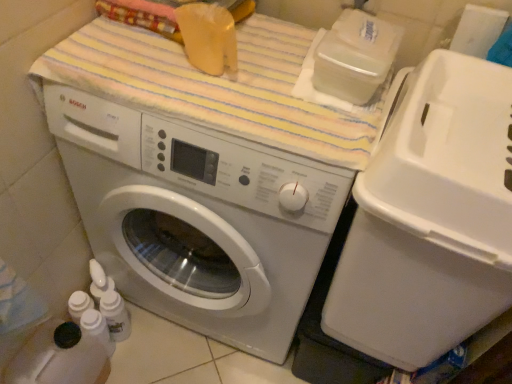
Question: From a real-world perspective, is striped cotton bath towel at upper center under white plastic water cooler at right?

Choices:
 (A) yes
 (B) no

Answer: (B)

Question: Does striped cotton bath towel at upper center turn towards white plastic water cooler at right?

Choices:
 (A) yes
 (B) no

Answer: (B)

Question: Considering the relative sizes of striped cotton bath towel at upper center and white plastic water cooler at right in the image provided, is striped cotton bath towel at upper center wider than white plastic water cooler at right?

Choices:
 (A) yes
 (B) no

Answer: (B)

Question: Is striped cotton bath towel at upper center touching white plastic water cooler at right?

Choices:
 (A) yes
 (B) no

Answer: (B)

Question: Can you confirm if striped cotton bath towel at upper center is shorter than white plastic water cooler at right?

Choices:
 (A) no
 (B) yes

Answer: (B)

Question: Considering the positions of striped cotton bath towel at upper center and white glossy washing machine at center in the image, is striped cotton bath towel at upper center wider or thinner than white glossy washing machine at center?

Choices:
 (A) wide
 (B) thin

Answer: (B)

Question: Relative to white glossy washing machine at center, is striped cotton bath towel at upper center in front or behind?

Choices:
 (A) front
 (B) behind

Answer: (B)

Question: Is striped cotton bath towel at upper center inside the boundaries of white glossy washing machine at center, or outside?

Choices:
 (A) outside
 (B) inside

Answer: (B)

Question: Is point (269, 59) closer or farther from the camera than point (84, 178)?

Choices:
 (A) farther
 (B) closer

Answer: (B)

Question: From the image's perspective, is white plastic water cooler at right positioned above or below white glossy washing machine at center?

Choices:
 (A) above
 (B) below

Answer: (B)

Question: Is white plastic water cooler at right in front of or behind white glossy washing machine at center in the image?

Choices:
 (A) front
 (B) behind

Answer: (A)

Question: Considering the positions of white plastic water cooler at right and white glossy washing machine at center in the image, is white plastic water cooler at right bigger or smaller than white glossy washing machine at center?

Choices:
 (A) small
 (B) big

Answer: (A)

Question: From their relative heights in the image, would you say white plastic water cooler at right is taller or shorter than white glossy washing machine at center?

Choices:
 (A) short
 (B) tall

Answer: (A)

Question: Relative to striped cotton bath towel at upper center, is white plastic water cooler at right in front or behind?

Choices:
 (A) behind
 (B) front

Answer: (B)

Question: In terms of height, does white plastic water cooler at right look taller or shorter compared to striped cotton bath towel at upper center?

Choices:
 (A) tall
 (B) short

Answer: (A)